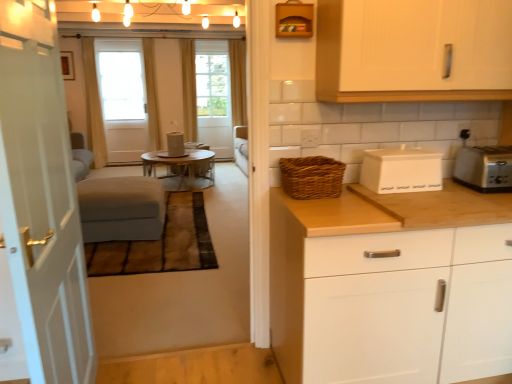
Question: Considering the positions of suede-like gray couch at left and white matte bread box at upper right, which is the first appliance in bottom-to-top order, in the image, is suede-like gray couch at left bigger or smaller than white matte bread box at upper right, which is the first appliance in bottom-to-top order,?

Choices:
 (A) small
 (B) big

Answer: (B)

Question: Would you say suede-like gray couch at left is to the left or to the right of white matte bread box at upper right, positioned as the 1th appliance in right-to-left order, in the picture?

Choices:
 (A) left
 (B) right

Answer: (A)

Question: Which object is the closest to the matte gray cylinder at center, positioned as the 2th appliance in right-to-left order?

Choices:
 (A) beige fabric curtain at center, arranged as the second curtain when viewed from the left
 (B) yellow fabric curtain at center, placed as the third curtain when sorted from left to right
 (C) yellow fabric curtain at upper center, the 4th curtain in the left-to-right sequence
 (D) white wood cabinet at upper right, placed as the 2th cabinetry when sorted from bottom to top
 (E) beige fabric curtain at left, which is the 1th curtain in left-to-right order

Answer: (A)

Question: Considering the real-world distances, which object is farthest from the white matte cabinet at right, the 2th cabinetry when ordered from top to bottom?

Choices:
 (A) clear glass screen door at upper left, the 2th screen door from the right
 (B) clear glass screen door at center, the 1th screen door from the right
 (C) white wood cabinet at upper right, placed as the 2th cabinetry when sorted from bottom to top
 (D) metallic silver table at center
 (E) yellow fabric curtain at center, placed as the third curtain when sorted from left to right

Answer: (B)